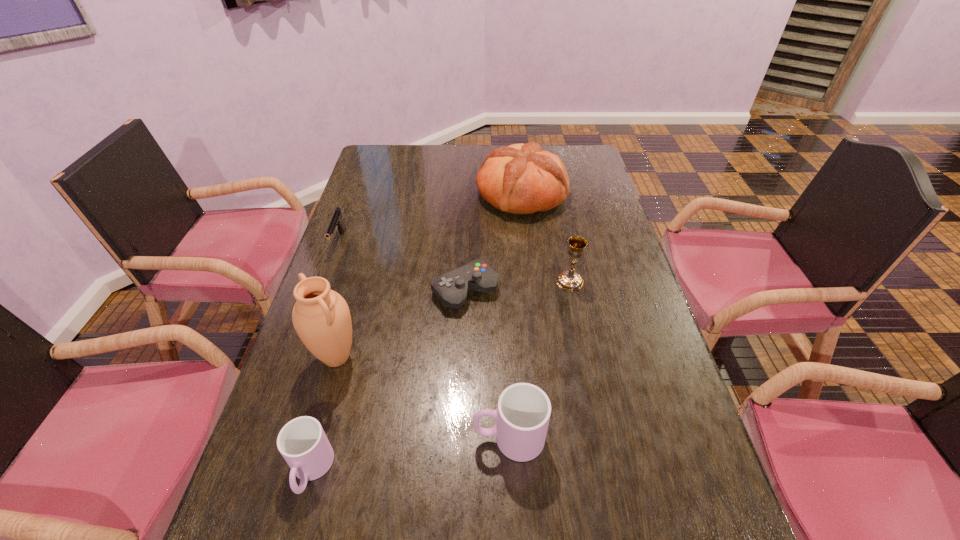
At what (x,y) coordinates should I click in order to perform the action: click on free space between the fifth tallest object and the shortest object. Please return your answer as a coordinate pair (x, y). Looking at the image, I should click on [388, 381].

The width and height of the screenshot is (960, 540). I want to click on vacant point located between the third shortest object and the chalice, so click(x=441, y=376).

The width and height of the screenshot is (960, 540). I want to click on object that is the fourth closest to the shorter cup, so point(336,221).

The height and width of the screenshot is (540, 960). I want to click on object that is the fifth nearest to the third shortest object, so click(x=569, y=280).

Locate an element on the screen. The image size is (960, 540). free space in the image that satisfies the following two spatial constraints: 1. with the handle on the side of the right cup; 2. at the muzzle of the leftmost object is located at coordinates (499, 241).

Locate an element on the screen. The width and height of the screenshot is (960, 540). free point that satisfies the following two spatial constraints: 1. at the muzzle of the second farthest object; 2. with the handle on the side of the taller cup is located at coordinates (268, 438).

You are a GUI agent. You are given a task and a screenshot of the screen. Output one action in this format:
    pyautogui.click(x=<x>, y=<y>)
    Task: Click on the free space that satisfies the following two spatial constraints: 1. at the muzzle of the urn; 2. on the left side of the pistol
    The width and height of the screenshot is (960, 540).
    Given the screenshot: What is the action you would take?
    pyautogui.click(x=298, y=357)

At what (x,y) coordinates should I click in order to perform the action: click on vacant space that satisfies the following two spatial constraints: 1. with the handle on the side of the chalice; 2. on the left side of the taller cup. Please return your answer as a coordinate pair (x, y). This screenshot has height=540, width=960. Looking at the image, I should click on (501, 281).

The image size is (960, 540). I want to click on vacant position in the image that satisfies the following two spatial constraints: 1. at the muzzle of the tallest object; 2. on the right side of the sixth nearest object, so click(x=298, y=357).

Find the location of a particular element. vacant space that satisfies the following two spatial constraints: 1. on the front side of the tallest object; 2. with the handle on the side of the taller cup is located at coordinates (314, 438).